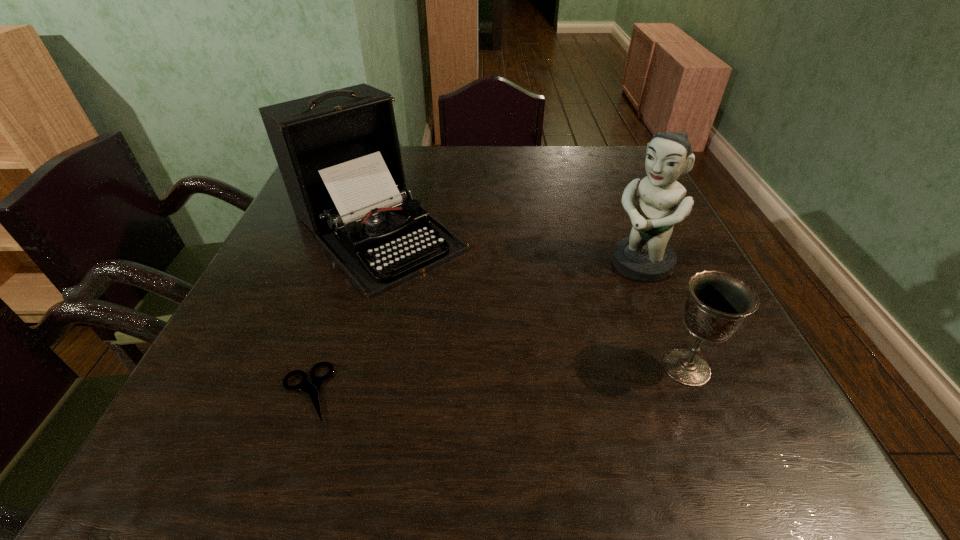
Find the location of a particular element. Image resolution: width=960 pixels, height=540 pixels. vacant space that is in between the shortest object and the chalice is located at coordinates (496, 380).

The height and width of the screenshot is (540, 960). Identify the location of empty space between the second shortest object and the shears. (496, 380).

Find the location of a particular element. The height and width of the screenshot is (540, 960). vacant space that is in between the shortest object and the typewriter is located at coordinates (341, 310).

Where is `free space between the shears and the figurine`? free space between the shears and the figurine is located at coordinates (473, 328).

The width and height of the screenshot is (960, 540). In order to click on free space between the shears and the second shortest object in this screenshot , I will do `click(496, 380)`.

What are the coordinates of `blank region between the typewriter and the shortest object` in the screenshot? It's located at (341, 310).

This screenshot has width=960, height=540. In order to click on free spot between the shears and the chalice in this screenshot , I will do pos(496,380).

Choose which object is the second nearest neighbor to the shears. Please provide its 2D coordinates. Your answer should be formatted as a tuple, i.e. [(x, y)], where the tuple contains the x and y coordinates of a point satisfying the conditions above.

[(717, 305)]

I want to click on object that is the second closest one to the typewriter, so click(x=645, y=255).

The width and height of the screenshot is (960, 540). I want to click on blank area in the image that satisfies the following two spatial constraints: 1. on the front side of the typewriter; 2. on the left side of the chalice, so click(x=334, y=367).